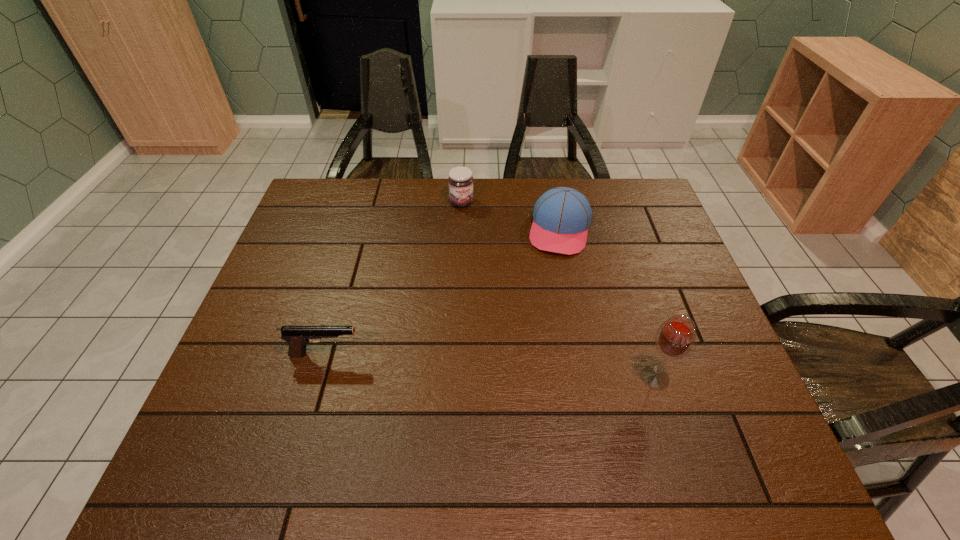
In order to click on vacant space on the desktop that is between the second nearest object and the wineglass and is positioned on the front-facing side of the baseball cap in this screenshot , I will do `click(530, 368)`.

The height and width of the screenshot is (540, 960). Find the location of `vacant space on the desktop that is between the pistol and the rightmost object and is positioned on the front label of the jam`. vacant space on the desktop that is between the pistol and the rightmost object and is positioned on the front label of the jam is located at coordinates (535, 369).